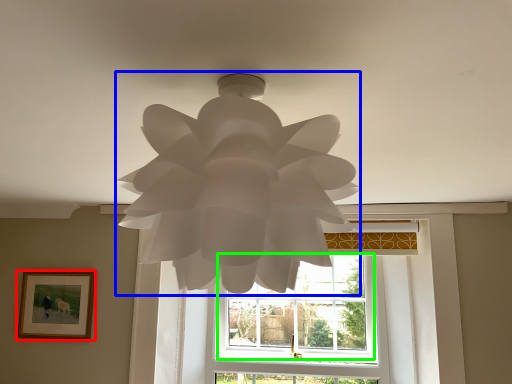
Question: Which object is positioned farthest from picture frame (highlighted by a red box)? Select from lamp (highlighted by a blue box) and window (highlighted by a green box).

Choices:
 (A) lamp
 (B) window

Answer: (A)